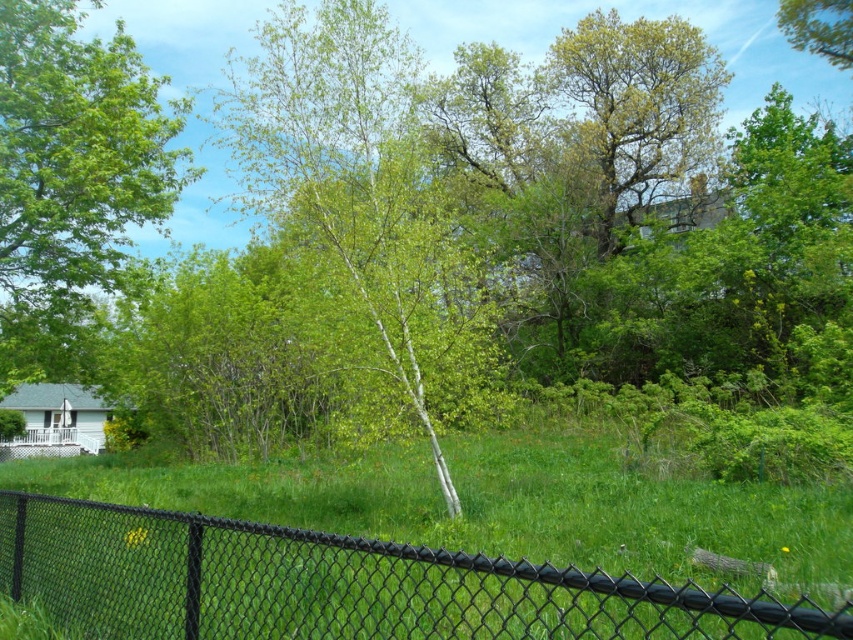
You are standing at the camera position looking at the scene. There are two points marked in the image, one at point coordinates point (131, 548) and another at point (53, 371). Which of these points is nearer to you?

Point (131, 548) is closer to the camera than point (53, 371), so the point at (131, 548) is nearer to you.

You are standing in the field beyond the fence and want to walk towards the white smooth tree at center. Which direction should you walk to avoid the green leafy tree at left?

The white smooth tree at center is positioned over the green leafy tree at left, so you should walk towards the center direction to reach the white smooth tree at center while avoiding the green leafy tree at left.